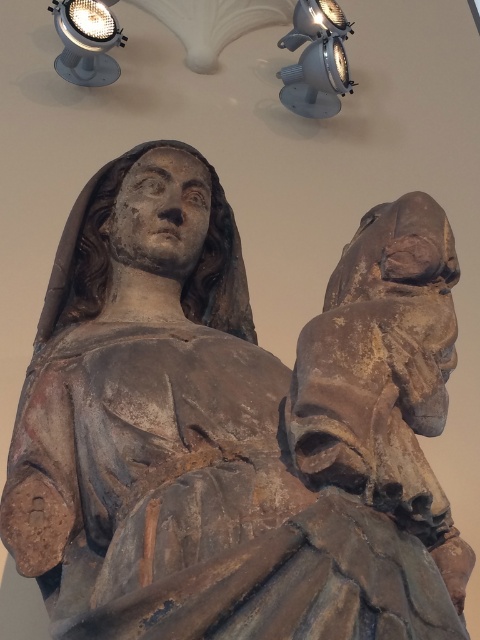
Does metallic industrial spotlight at upper center appear over matte silver spotlight at upper left?

No, metallic industrial spotlight at upper center is not above matte silver spotlight at upper left.

Is point (304, 81) closer to viewer compared to point (96, 83)?

No.

I want to click on metallic industrial spotlight at upper center, so click(315, 60).